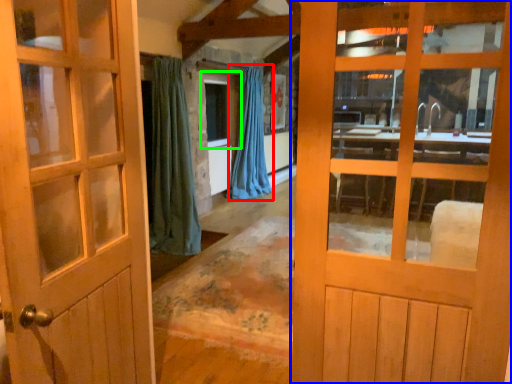
Question: Which object is positioned closest to curtain (highlighted by a red box)? Select from door (highlighted by a blue box) and window (highlighted by a green box).

Choices:
 (A) door
 (B) window

Answer: (B)